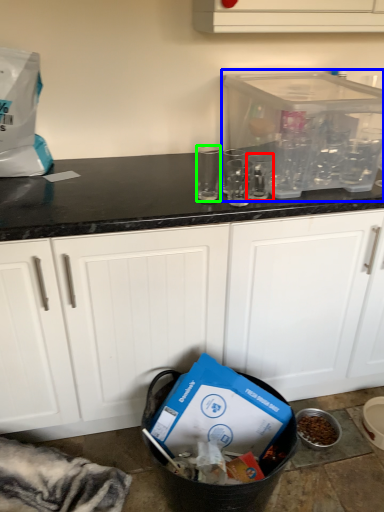
Question: Which is farther away from clear (highlighted by a red box)? appliance (highlighted by a blue box) or clear (highlighted by a green box)?

Choices:
 (A) appliance
 (B) clear

Answer: (B)